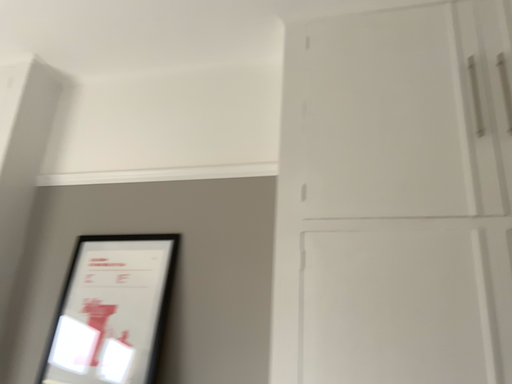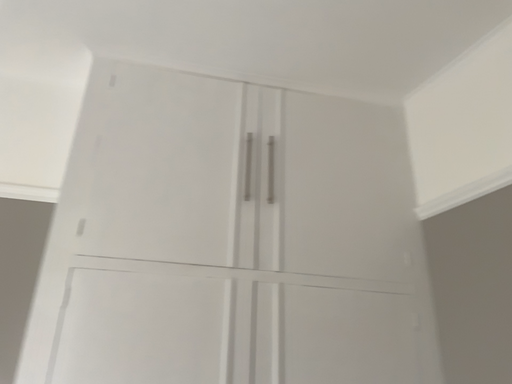
Question: How did the camera likely rotate when shooting the video?

Choices:
 (A) rotated right
 (B) rotated left

Answer: (A)